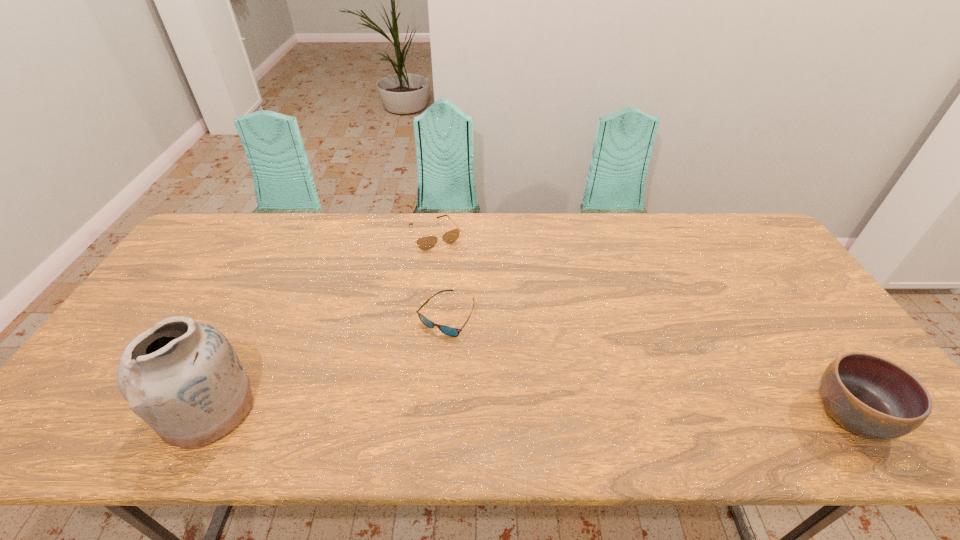
Identify the location of vacant space that's between the second tallest object and the second farthest object. (648, 366).

At what (x,y) coordinates should I click in order to perform the action: click on free spot between the second shortest object and the leftmost object. Please return your answer as a coordinate pair (x, y). The image size is (960, 540). Looking at the image, I should click on (322, 321).

Locate an element on the screen. Image resolution: width=960 pixels, height=540 pixels. vacant region between the rightmost object and the farthest object is located at coordinates (643, 325).

Image resolution: width=960 pixels, height=540 pixels. Identify the location of empty space that is in between the third tallest object and the shortest object. (441, 275).

This screenshot has height=540, width=960. I want to click on vacant space that's between the second tallest object and the shortest object, so click(648, 366).

Identify which object is located as the nearest to the shorter sunglasses. Please provide its 2D coordinates. Your answer should be formatted as a tuple, i.e. [(x, y)], where the tuple contains the x and y coordinates of a point satisfying the conditions above.

[(424, 243)]

Find the location of a particular element. object that is the third closest to the taller sunglasses is located at coordinates (866, 394).

You are a GUI agent. You are given a task and a screenshot of the screen. Output one action in this format:
    pyautogui.click(x=<x>, y=<y>)
    Task: Click on the vacant region that satisfies the following two spatial constraints: 1. on the back side of the tallest object; 2. on the left side of the shortest object
    
    Given the screenshot: What is the action you would take?
    pyautogui.click(x=254, y=316)

This screenshot has width=960, height=540. Identify the location of vacant area in the image that satisfies the following two spatial constraints: 1. on the back side of the pottery; 2. on the right side of the third tallest object. (296, 234).

This screenshot has width=960, height=540. In order to click on free spot that satisfies the following two spatial constraints: 1. on the front side of the leftmost object; 2. on the right side of the rightmost object in this screenshot , I will do `click(205, 415)`.